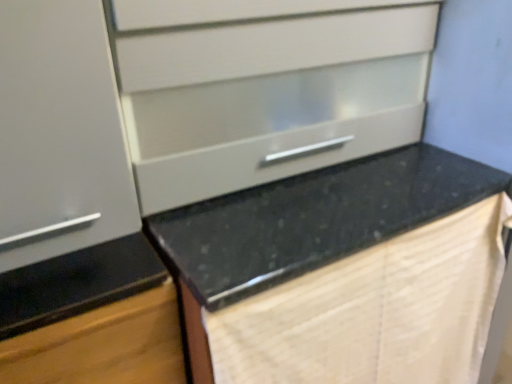
Where is `matte white cabinet at left, the second cabinetry ordered from the bottom`? This screenshot has width=512, height=384. matte white cabinet at left, the second cabinetry ordered from the bottom is located at coordinates (60, 133).

The image size is (512, 384). I want to click on matte white drawer at upper center, so click(264, 89).

What do you see at coordinates (374, 311) in the screenshot?
I see `beige textured blanket at lower right` at bounding box center [374, 311].

At what (x,y) coordinates should I click in order to perform the action: click on matte black cabinet at left, the 2th cabinetry from the top. Please return your answer as a coordinate pair (x, y). Looking at the image, I should click on (91, 318).

Describe the element at coordinates (313, 219) in the screenshot. The height and width of the screenshot is (384, 512). I see `black granite countertop at center` at that location.

Identify the location of matte white cabinet at left, the second cabinetry ordered from the bottom. Image resolution: width=512 pixels, height=384 pixels. (60, 133).

How many degrees apart are the facing directions of beige textured blanket at lower right and matte black cabinet at left, which ranks as the 1th cabinetry in bottom-to-top order?

beige textured blanket at lower right and matte black cabinet at left, which ranks as the 1th cabinetry in bottom-to-top order, are facing 0.000419 degrees away from each other.

Is beige textured blanket at lower right to the left or to the right of matte black cabinet at left, which ranks as the 1th cabinetry in bottom-to-top order, in the image?

Based on their positions, beige textured blanket at lower right is located to the right of matte black cabinet at left, which ranks as the 1th cabinetry in bottom-to-top order.

From a real-world perspective, which object stands above the other?

matte black cabinet at left, which ranks as the 1th cabinetry in bottom-to-top order, from a real-world perspective.

Is beige textured blanket at lower right far from matte black cabinet at left, the 2th cabinetry from the top?

No, beige textured blanket at lower right is in close proximity to matte black cabinet at left, the 2th cabinetry from the top.

I want to click on cabinetry above the black granite countertop at center (from the image's perspective), so click(60, 133).

Do you think black granite countertop at center is within matte white cabinet at left, arranged as the 1th cabinetry when viewed from the top, or outside of it?

black granite countertop at center is not enclosed by matte white cabinet at left, arranged as the 1th cabinetry when viewed from the top.

From the image's perspective, which is above, black granite countertop at center or matte white cabinet at left, arranged as the 1th cabinetry when viewed from the top?

matte white cabinet at left, arranged as the 1th cabinetry when viewed from the top.

Does point (277, 211) come closer to viewer compared to point (110, 58)?

That is False.

What's the angular difference between matte white cabinet at left, arranged as the 1th cabinetry when viewed from the top, and matte white drawer at upper center's facing directions?

They differ by 0.000285 degrees in their facing directions.

From a real-world perspective, which object stands above the other?

matte white drawer at upper center, from a real-world perspective.

You are a GUI agent. You are given a task and a screenshot of the screen. Output one action in this format:
    pyautogui.click(x=<x>, y=<y>)
    Task: Click on the drawer above the matte white cabinet at left, the second cabinetry ordered from the bottom (from the image's perspective)
    Image resolution: width=512 pixels, height=384 pixels.
    Given the screenshot: What is the action you would take?
    pyautogui.click(x=264, y=89)

Is matte white cabinet at left, the second cabinetry ordered from the bottom, positioned with its back to matte white drawer at upper center?

No.

Can you confirm if matte white drawer at upper center is bigger than beige textured blanket at lower right?

Correct, matte white drawer at upper center is larger in size than beige textured blanket at lower right.

Is matte white drawer at upper center turned away from beige textured blanket at lower right?

matte white drawer at upper center is not turned away from beige textured blanket at lower right.

Based on the photo, between matte white drawer at upper center and beige textured blanket at lower right, which one has more height?

beige textured blanket at lower right is taller.

Looking at this image, from a real-world perspective, is matte white drawer at upper center on top of beige textured blanket at lower right?

Yes, from a real-world perspective, matte white drawer at upper center is above beige textured blanket at lower right.

Can you tell me how much matte white drawer at upper center and matte white cabinet at left, the second cabinetry ordered from the bottom, differ in facing direction?

matte white drawer at upper center and matte white cabinet at left, the second cabinetry ordered from the bottom, are facing 0.000285 degrees away from each other.

Which object is positioned more to the right, matte white drawer at upper center or matte white cabinet at left, arranged as the 1th cabinetry when viewed from the top?

Positioned to the right is matte white drawer at upper center.

Considering their positions, is matte white drawer at upper center located in front of or behind matte white cabinet at left, the second cabinetry ordered from the bottom?

Visually, matte white drawer at upper center is located behind matte white cabinet at left, the second cabinetry ordered from the bottom.

How different are the orientations of matte black cabinet at left, which ranks as the 1th cabinetry in bottom-to-top order, and beige textured blanket at lower right in degrees?

0.000419 degrees separate the facing orientations of matte black cabinet at left, which ranks as the 1th cabinetry in bottom-to-top order, and beige textured blanket at lower right.

Considering the sizes of matte black cabinet at left, which ranks as the 1th cabinetry in bottom-to-top order, and beige textured blanket at lower right in the image, is matte black cabinet at left, which ranks as the 1th cabinetry in bottom-to-top order, bigger or smaller than beige textured blanket at lower right?

Clearly, matte black cabinet at left, which ranks as the 1th cabinetry in bottom-to-top order, is larger in size than beige textured blanket at lower right.

Considering the positions of objects matte black cabinet at left, which ranks as the 1th cabinetry in bottom-to-top order, and beige textured blanket at lower right in the image provided, who is more to the right, matte black cabinet at left, which ranks as the 1th cabinetry in bottom-to-top order, or beige textured blanket at lower right?

beige textured blanket at lower right.

Which object is thinner, matte black cabinet at left, the 2th cabinetry from the top, or beige textured blanket at lower right?

With smaller width is beige textured blanket at lower right.

Is matte white cabinet at left, the second cabinetry ordered from the bottom, not inside black granite countertop at center?

matte white cabinet at left, the second cabinetry ordered from the bottom, lies outside black granite countertop at center's area.

Consider the image. From the image's perspective, is matte white cabinet at left, arranged as the 1th cabinetry when viewed from the top, on black granite countertop at center?

Correct, matte white cabinet at left, arranged as the 1th cabinetry when viewed from the top, appears higher than black granite countertop at center in the image.

Who is shorter, matte white cabinet at left, arranged as the 1th cabinetry when viewed from the top, or black granite countertop at center?

Standing shorter between the two is matte white cabinet at left, arranged as the 1th cabinetry when viewed from the top.

I want to click on blanket lying above the matte black cabinet at left, which ranks as the 1th cabinetry in bottom-to-top order (from the image's perspective), so click(374, 311).

At what (x,y) coordinates should I click in order to perform the action: click on countertop that appears behind the matte white cabinet at left, arranged as the 1th cabinetry when viewed from the top. Please return your answer as a coordinate pair (x, y). The width and height of the screenshot is (512, 384). Looking at the image, I should click on (313, 219).

Looking at the image, which one is located further to matte white cabinet at left, the second cabinetry ordered from the bottom, matte white drawer at upper center or matte black cabinet at left, the 2th cabinetry from the top?

matte white drawer at upper center is positioned further to the anchor matte white cabinet at left, the second cabinetry ordered from the bottom.

Based on their spatial positions, is beige textured blanket at lower right or matte white drawer at upper center further from matte black cabinet at left, the 2th cabinetry from the top?

Among the two, matte white drawer at upper center is located further to matte black cabinet at left, the 2th cabinetry from the top.

Estimate the real-world distances between objects in this image. Which object is further from matte white cabinet at left, the second cabinetry ordered from the bottom, matte white drawer at upper center or beige textured blanket at lower right?

beige textured blanket at lower right is positioned further to the anchor matte white cabinet at left, the second cabinetry ordered from the bottom.

Estimate the real-world distances between objects in this image. Which object is further from beige textured blanket at lower right, black granite countertop at center or matte black cabinet at left, the 2th cabinetry from the top?

Among the two, matte black cabinet at left, the 2th cabinetry from the top, is located further to beige textured blanket at lower right.

Looking at the image, which one is located closer to matte white drawer at upper center, matte white cabinet at left, the second cabinetry ordered from the bottom, or beige textured blanket at lower right?

matte white cabinet at left, the second cabinetry ordered from the bottom, is positioned closer to the anchor matte white drawer at upper center.

Looking at the image, which one is located closer to black granite countertop at center, matte white cabinet at left, the second cabinetry ordered from the bottom, or matte black cabinet at left, the 2th cabinetry from the top?

Based on the image, matte black cabinet at left, the 2th cabinetry from the top, appears to be nearer to black granite countertop at center.

Looking at the image, which one is located further to matte black cabinet at left, the 2th cabinetry from the top, beige textured blanket at lower right or black granite countertop at center?

beige textured blanket at lower right.

Which object lies further to the anchor point black granite countertop at center, matte black cabinet at left, the 2th cabinetry from the top, or matte white cabinet at left, arranged as the 1th cabinetry when viewed from the top?

Based on the image, matte white cabinet at left, arranged as the 1th cabinetry when viewed from the top, appears to be further to black granite countertop at center.

The image size is (512, 384). Find the location of `cabinetry between matte white drawer at upper center and black granite countertop at center vertically`. cabinetry between matte white drawer at upper center and black granite countertop at center vertically is located at coordinates (60, 133).

You are a GUI agent. You are given a task and a screenshot of the screen. Output one action in this format:
    pyautogui.click(x=<x>, y=<y>)
    Task: Click on the cabinetry between matte white cabinet at left, the second cabinetry ordered from the bottom, and beige textured blanket at lower right from left to right
    
    Given the screenshot: What is the action you would take?
    pyautogui.click(x=91, y=318)

You are a GUI agent. You are given a task and a screenshot of the screen. Output one action in this format:
    pyautogui.click(x=<x>, y=<y>)
    Task: Click on the countertop between matte white cabinet at left, the second cabinetry ordered from the bottom, and beige textured blanket at lower right
    
    Given the screenshot: What is the action you would take?
    pyautogui.click(x=313, y=219)

This screenshot has height=384, width=512. Find the location of `countertop between matte white drawer at upper center and beige textured blanket at lower right in the up-down direction`. countertop between matte white drawer at upper center and beige textured blanket at lower right in the up-down direction is located at coordinates (313, 219).